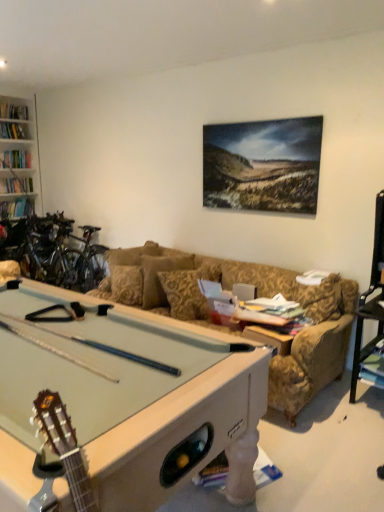
Question: From a real-world perspective, is light green felt pool table at lower left physically below shiny metallic bicycles at left?

Choices:
 (A) no
 (B) yes

Answer: (B)

Question: Is light green felt pool table at lower left taller than shiny metallic bicycles at left?

Choices:
 (A) no
 (B) yes

Answer: (A)

Question: Considering the relative sizes of light green felt pool table at lower left and shiny metallic bicycles at left in the image provided, is light green felt pool table at lower left shorter than shiny metallic bicycles at left?

Choices:
 (A) yes
 (B) no

Answer: (A)

Question: Are light green felt pool table at lower left and shiny metallic bicycles at left far apart?

Choices:
 (A) yes
 (B) no

Answer: (A)

Question: Is light green felt pool table at lower left outside of shiny metallic bicycles at left?

Choices:
 (A) yes
 (B) no

Answer: (A)

Question: Is light green felt pool table at lower left inside the boundaries of shiny metallic bicycles at left, or outside?

Choices:
 (A) inside
 (B) outside

Answer: (B)

Question: In terms of width, does light green felt pool table at lower left look wider or thinner when compared to shiny metallic bicycles at left?

Choices:
 (A) thin
 (B) wide

Answer: (B)

Question: Is point (236, 367) positioned closer to the camera than point (26, 275)?

Choices:
 (A) farther
 (B) closer

Answer: (B)

Question: From the image's perspective, relative to shiny metallic bicycles at left, is light green felt pool table at lower left above or below?

Choices:
 (A) above
 (B) below

Answer: (B)

Question: In terms of size, does shiny metallic bicycles at left appear bigger or smaller than light green felt pool table at lower left?

Choices:
 (A) small
 (B) big

Answer: (B)

Question: From the image's perspective, is shiny metallic bicycles at left above or below light green felt pool table at lower left?

Choices:
 (A) below
 (B) above

Answer: (B)

Question: From a real-world perspective, is shiny metallic bicycles at left positioned above or below light green felt pool table at lower left?

Choices:
 (A) below
 (B) above

Answer: (B)

Question: Relative to light green felt pool table at lower left, is shiny metallic bicycles at left in front or behind?

Choices:
 (A) front
 (B) behind

Answer: (B)

Question: Do you think gold floral-patterned pillow at center is within light green felt pool table at lower left, or outside of it?

Choices:
 (A) inside
 (B) outside

Answer: (B)

Question: From the image's perspective, is gold floral-patterned pillow at center above or below light green felt pool table at lower left?

Choices:
 (A) above
 (B) below

Answer: (A)